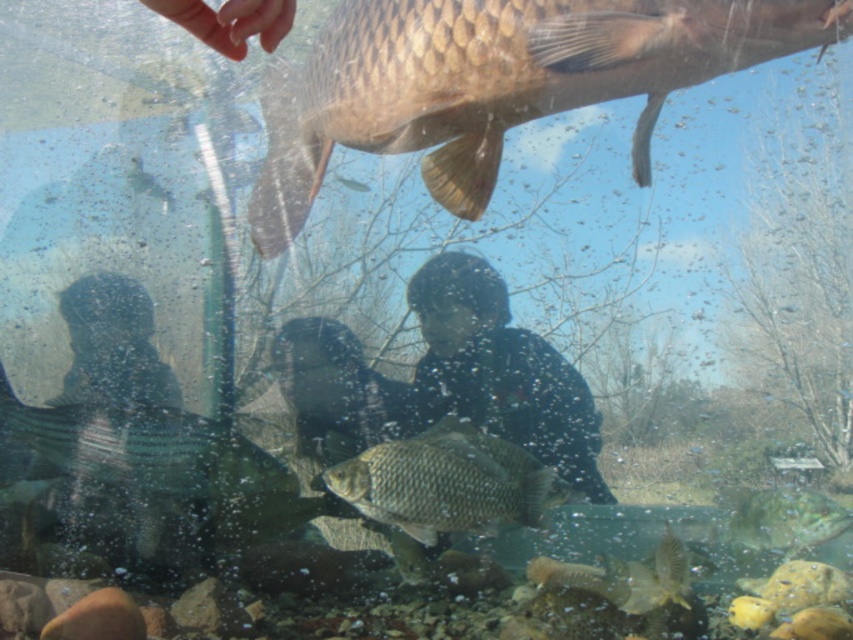
Which is more to the left, shiny silver fish at lower left or shiny silver fish at center?

Positioned to the left is shiny silver fish at lower left.

Does point (180, 440) come behind point (492, 516)?

Yes, it is behind point (492, 516).

The height and width of the screenshot is (640, 853). I want to click on shiny silver fish at lower left, so click(141, 448).

Is dark blue fabric at center smaller than shiny silver fish at center?

Actually, dark blue fabric at center might be larger than shiny silver fish at center.

Is dark blue fabric at center taller than shiny silver fish at center?

Indeed, dark blue fabric at center has a greater height compared to shiny silver fish at center.

Where is `dark blue fabric at center`? The height and width of the screenshot is (640, 853). dark blue fabric at center is located at coordinates (500, 371).

Find the location of a particular element. dark blue fabric at center is located at coordinates (500, 371).

Is dark blue fabric at center below shiny silver fish at lower left?

Incorrect, dark blue fabric at center is not positioned below shiny silver fish at lower left.

Is point (535, 456) closer to viewer compared to point (49, 412)?

Yes.

Image resolution: width=853 pixels, height=640 pixels. In order to click on dark blue fabric at center in this screenshot , I will do point(500,371).